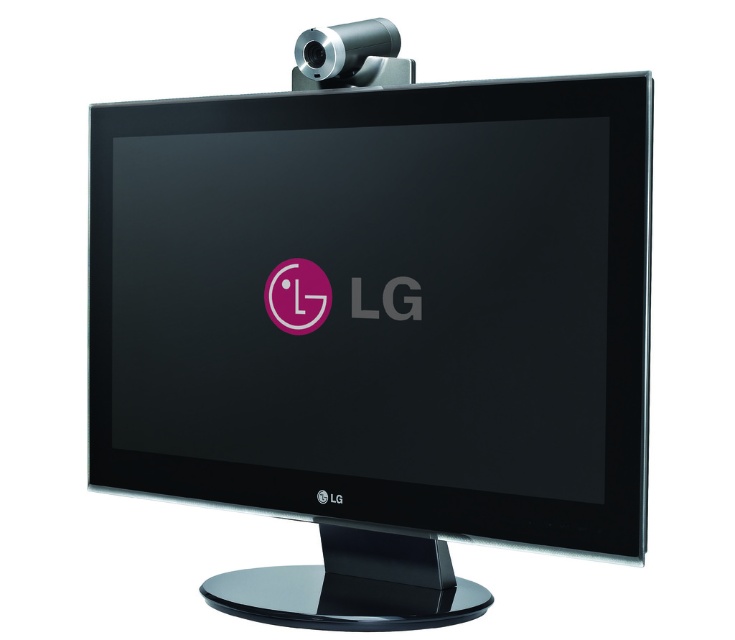
You are setting up a video call and need to position your laptop so that both the black glossy monitor at center and the silver metallic webcam at top are visible. Which object should you place your laptop closer to ensure the webcam captures both?

You should place your laptop closer to the silver metallic webcam at top because the black glossy monitor at center is located below it, so positioning the laptop near the webcam ensures both are within the camera view.

You are a photographer taking a picture of the monitor. You notice two points on the monitor screen at coordinates point (358, 394) and point (370, 60). Which point will appear larger in your photo?

Point (358, 394) will appear larger in the photo because it is closer to the camera than point (370, 60).